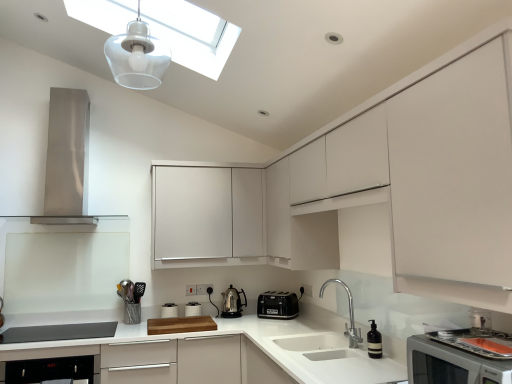
Question: Based on their sizes in the image, would you say white matte countertop at center is bigger or smaller than white matte cabinet at center, the 2th cabinetry when ordered from back to front?

Choices:
 (A) small
 (B) big

Answer: (A)

Question: Is white matte countertop at center to the left or to the right of white matte cabinet at center, the 2th cabinetry when ordered from back to front, in the image?

Choices:
 (A) right
 (B) left

Answer: (B)

Question: Which object is the farthest from the metallic silver utensil holder at lower left?

Choices:
 (A) white matte cabinet at center, which appears as the first cabinetry when viewed from the back
 (B) matte white microwave at lower right, which is the first home appliance in front-to-back order
 (C) white matte countertop at center
 (D) polished stainless steel kettle at center, acting as the first kitchen appliance starting from the left
 (E) translucent plastic light fixture at upper center

Answer: (B)

Question: Considering the real-world distances, which object is closest to the metallic silver utensil holder at lower left?

Choices:
 (A) stainless steel range hood at left, the 1th home appliance in the top-to-bottom sequence
 (B) white matte countertop at center
 (C) transparent glass skylight at upper center
 (D) white matte cabinet at center, the 2th cabinetry when ordered from back to front
 (E) polished stainless steel faucet at lower center

Answer: (B)